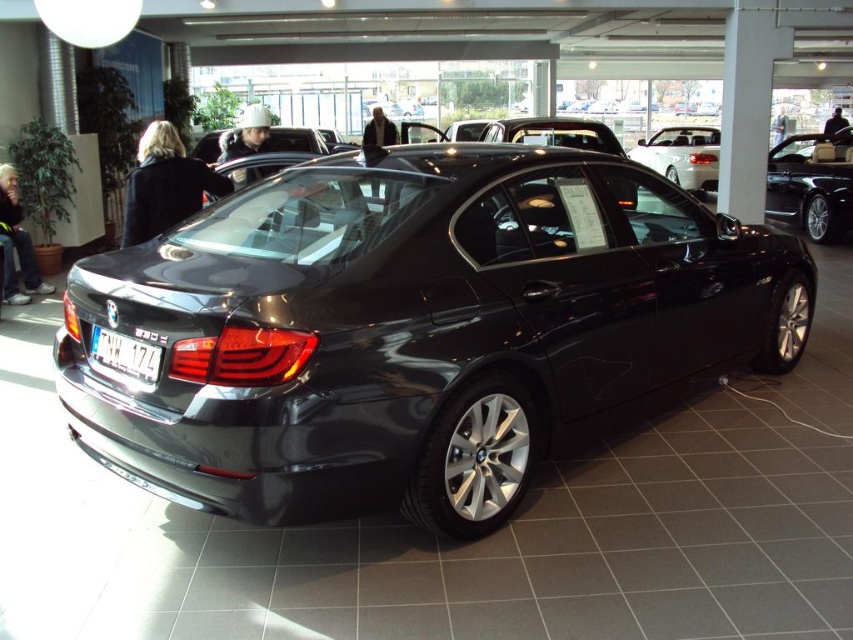
Which of these two, satin silver sedan at center or white plastic license plate at rear, stands taller?

satin silver sedan at center is taller.

Between point (643, 154) and point (96, 340), which one is positioned in front?

Positioned in front is point (96, 340).

Locate an element on the screen. This screenshot has height=640, width=853. satin silver sedan at center is located at coordinates (682, 156).

Does point (199, 435) lie in front of point (90, 355)?

Yes, it is in front of point (90, 355).

Locate an element on the screen. The width and height of the screenshot is (853, 640). glossy metallic car at center is located at coordinates (413, 326).

Who is positioned more to the right, glossy metallic car at center or satin silver sedan at center?

Positioned to the right is satin silver sedan at center.

Can you confirm if glossy metallic car at center is positioned below satin silver sedan at center?

Correct, glossy metallic car at center is located below satin silver sedan at center.

Describe the element at coordinates (413, 326) in the screenshot. I see `glossy metallic car at center` at that location.

Identify the location of glossy metallic car at center. (413, 326).